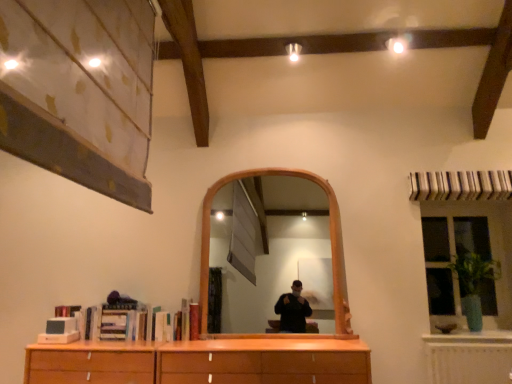
Question: Can you confirm if green glass vase at right is smaller than green glossy vase at right?

Choices:
 (A) yes
 (B) no

Answer: (B)

Question: From a real-world perspective, does green glass vase at right sit lower than green glossy vase at right?

Choices:
 (A) no
 (B) yes

Answer: (A)

Question: Is green glass vase at right bigger than green glossy vase at right?

Choices:
 (A) no
 (B) yes

Answer: (B)

Question: Is green glass vase at right at the right side of green glossy vase at right?

Choices:
 (A) no
 (B) yes

Answer: (B)

Question: Is green glass vase at right shorter than green glossy vase at right?

Choices:
 (A) yes
 (B) no

Answer: (B)

Question: Is green glass vase at right positioned with its back to green glossy vase at right?

Choices:
 (A) yes
 (B) no

Answer: (A)

Question: Is green glossy vase at right touching green glass vase at right?

Choices:
 (A) no
 (B) yes

Answer: (A)

Question: Considering the relative sizes of green glossy vase at right and green glass vase at right in the image provided, is green glossy vase at right wider than green glass vase at right?

Choices:
 (A) yes
 (B) no

Answer: (A)

Question: From a real-world perspective, is green glossy vase at right located beneath green glass vase at right?

Choices:
 (A) yes
 (B) no

Answer: (A)

Question: From the image's perspective, is green glossy vase at right located above green glass vase at right?

Choices:
 (A) yes
 (B) no

Answer: (B)

Question: Is green glossy vase at right positioned behind green glass vase at right?

Choices:
 (A) no
 (B) yes

Answer: (A)

Question: Can you confirm if green glossy vase at right is taller than green glass vase at right?

Choices:
 (A) yes
 (B) no

Answer: (B)

Question: Considering the positions of green glossy vase at right and green glass vase at right in the image, is green glossy vase at right bigger or smaller than green glass vase at right?

Choices:
 (A) small
 (B) big

Answer: (A)